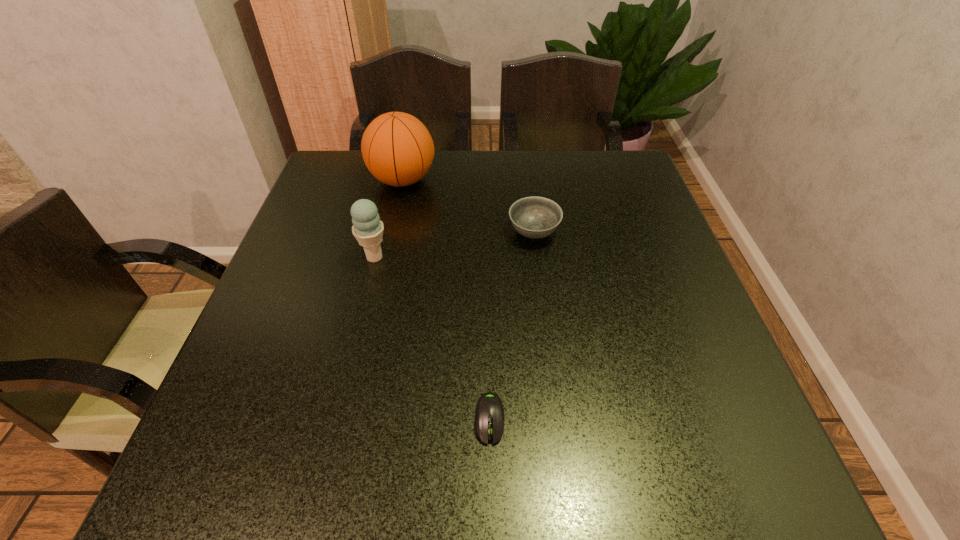
The image size is (960, 540). In the image, there is a desktop. Identify the location of vacant space at the far right corner. (623, 188).

Locate an element on the screen. vacant space in between the tallest object and the third tallest object is located at coordinates (468, 206).

Where is `vacant space that is in between the rightmost object and the second object from right to left`? vacant space that is in between the rightmost object and the second object from right to left is located at coordinates (512, 326).

At what (x,y) coordinates should I click in order to perform the action: click on vacant space that is in between the shortest object and the rightmost object. Please return your answer as a coordinate pair (x, y). The height and width of the screenshot is (540, 960). Looking at the image, I should click on (512, 326).

At what (x,y) coordinates should I click in order to perform the action: click on vacant space that is in between the ice cream and the third tallest object. Please return your answer as a coordinate pair (x, y). The image size is (960, 540). Looking at the image, I should click on (454, 245).

Where is `free space between the rightmost object and the nearest object`? free space between the rightmost object and the nearest object is located at coordinates coord(512,326).

Find the location of a particular element. Image resolution: width=960 pixels, height=540 pixels. vacant space that is in between the ice cream and the second shortest object is located at coordinates (454, 245).

Locate an element on the screen. vacant area that lies between the farthest object and the ice cream is located at coordinates (389, 219).

This screenshot has height=540, width=960. Find the location of `empty location between the second object from right to left and the ice cream`. empty location between the second object from right to left and the ice cream is located at coordinates (432, 339).

In order to click on empty space that is in between the ice cream and the third object from left to right in this screenshot , I will do `click(432, 339)`.